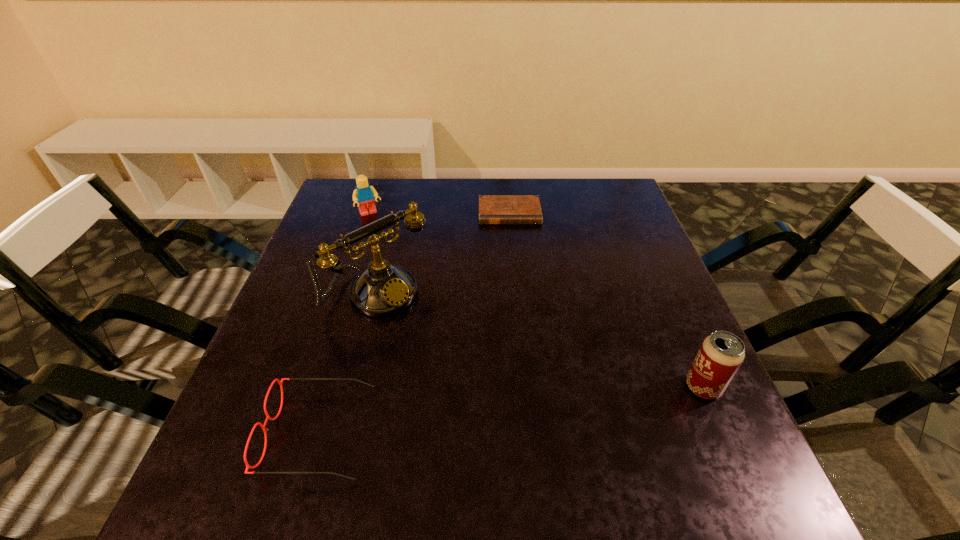
Identify the location of free space at the far left corner. (348, 202).

The image size is (960, 540). Find the location of `vacant space at the far right corner of the desktop`. vacant space at the far right corner of the desktop is located at coordinates (611, 195).

Find the location of a particular element. free point at the near right corner is located at coordinates (724, 415).

At what (x,y) coordinates should I click in order to perform the action: click on empty space between the shortest object and the spectacles. Please return your answer as a coordinate pair (x, y). The image size is (960, 540). Looking at the image, I should click on (415, 323).

Where is `free space between the second object from right to left and the rightmost object`? The width and height of the screenshot is (960, 540). free space between the second object from right to left and the rightmost object is located at coordinates (606, 300).

This screenshot has height=540, width=960. Identify the location of free space between the beer can and the diary. (606, 300).

Identify the location of empty space between the Lego and the shortest object. This screenshot has width=960, height=540. (440, 213).

At what (x,y) coordinates should I click in order to perform the action: click on empty space that is in between the rightmost object and the Lego. Please return your answer as a coordinate pair (x, y). The width and height of the screenshot is (960, 540). Looking at the image, I should click on (537, 301).

In order to click on vacant space that's between the second shortest object and the tallest object in this screenshot , I will do `click(348, 363)`.

This screenshot has height=540, width=960. I want to click on free space that is in between the beer can and the tallest object, so click(540, 341).